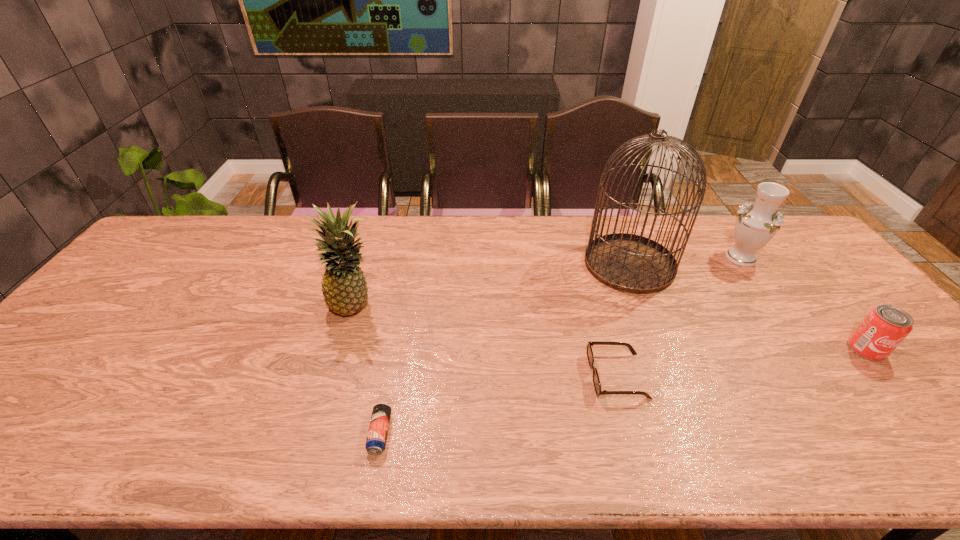
You are a GUI agent. You are given a task and a screenshot of the screen. Output one action in this format:
    pyautogui.click(x=<x>, y=<y>)
    Task: Click on the object positioned at the near edge
    The width and height of the screenshot is (960, 540).
    Given the screenshot: What is the action you would take?
    pyautogui.click(x=377, y=434)

Where is `object positioned at the right edge`? The height and width of the screenshot is (540, 960). object positioned at the right edge is located at coordinates (881, 331).

Identify the location of free space at the far edge of the desktop. The height and width of the screenshot is (540, 960). (389, 235).

Image resolution: width=960 pixels, height=540 pixels. Identify the location of vacant space at the near edge of the desktop. (107, 447).

The image size is (960, 540). In the image, there is a desktop. What are the coordinates of `vacant space at the right edge` in the screenshot? It's located at (957, 424).

You are a GUI agent. You are given a task and a screenshot of the screen. Output one action in this format:
    pyautogui.click(x=<x>, y=<y>)
    Task: Click on the blank space at the far right corner
    
    Given the screenshot: What is the action you would take?
    pyautogui.click(x=781, y=252)

Identify the location of empty location between the sunglasses and the fourth shortest object. The width and height of the screenshot is (960, 540). (679, 316).

Where is `empty space that is in between the second object from right to left and the fifth tallest object`? The image size is (960, 540). empty space that is in between the second object from right to left and the fifth tallest object is located at coordinates (679, 316).

The image size is (960, 540). I want to click on empty location between the fifth object from left to right and the tallest object, so click(685, 261).

Identify the location of free space between the third tallest object and the fifth object from right to left. (561, 346).